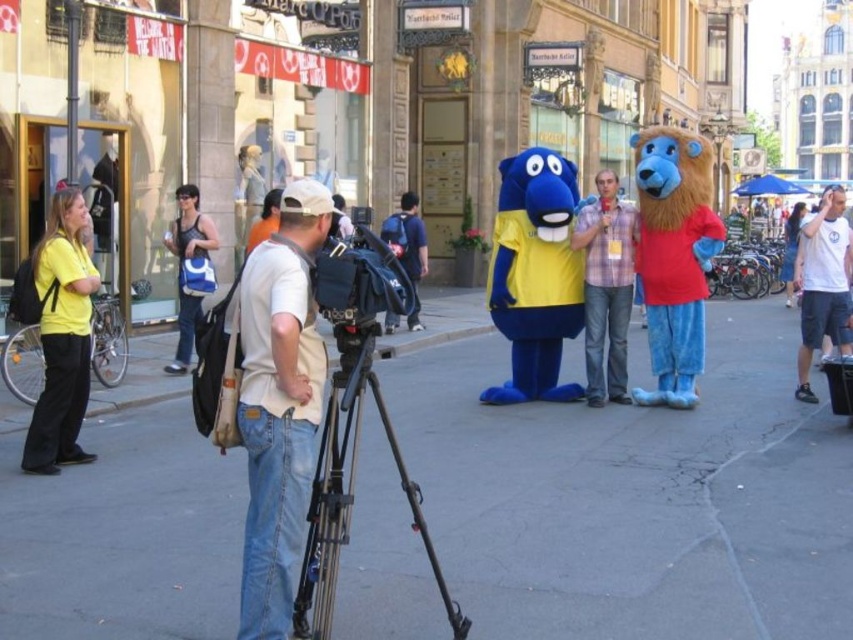
Question: Is black matte tripod at center above yellow matte shirt at left?

Choices:
 (A) yes
 (B) no

Answer: (B)

Question: Which of the following is the farthest from the observer?

Choices:
 (A) (697, 627)
 (B) (276, 417)

Answer: (A)

Question: From the image, what is the correct spatial relationship of black matte tripod at center in relation to plaid shirt at center?

Choices:
 (A) above
 (B) below

Answer: (B)

Question: Which point is closer to the camera?

Choices:
 (A) plaid shirt at center
 (B) white cotton t-shirt at right

Answer: (B)

Question: Is gray concrete pavement at center to the left of plaid shirt at center from the viewer's perspective?

Choices:
 (A) no
 (B) yes

Answer: (B)

Question: Among these points, which one is nearest to the camera?

Choices:
 (A) (331, 547)
 (B) (613, 275)
 (C) (59, 225)
 (D) (328, 209)

Answer: (A)